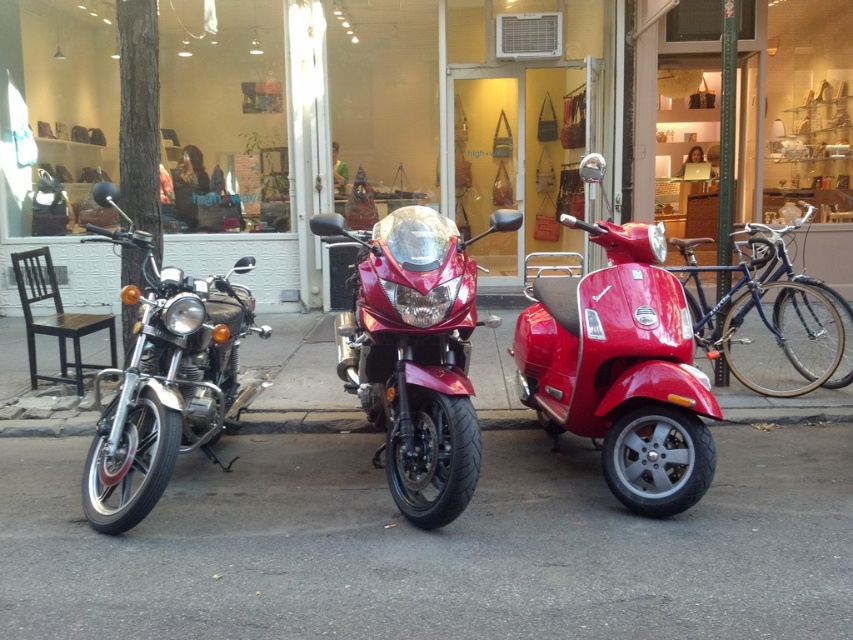
Question: Can you confirm if glossy red motorcycle at center is positioned below blue metallic bicycle at right?

Choices:
 (A) no
 (B) yes

Answer: (B)

Question: Which point is farther to the camera?

Choices:
 (A) (117, 179)
 (B) (633, 419)

Answer: (A)

Question: In this image, where is black asphalt at center located relative to glossy red motorcycle at center?

Choices:
 (A) right
 (B) left

Answer: (A)

Question: Estimate the real-world distances between objects in this image. Which object is farther from the shiny chrome motorcycle at left?

Choices:
 (A) shiny red scooter at center
 (B) black asphalt at center
 (C) matte black motorcycle at left

Answer: (C)

Question: In this image, where is black asphalt at center located relative to shiny red scooter at center?

Choices:
 (A) above
 (B) below

Answer: (B)

Question: Which of the following is the farthest from the observer?

Choices:
 (A) (184, 316)
 (B) (28, 557)
 (C) (82, 106)
 (D) (746, 260)

Answer: (C)